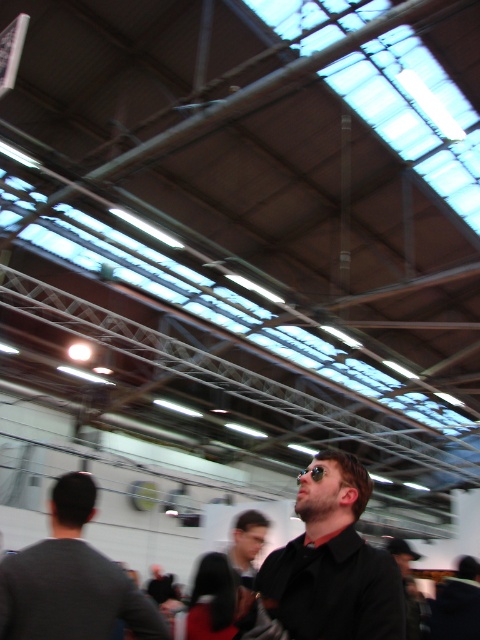
You are a fashion stylist arranging items on a display table. You have a black matte shirt at center and sunglasses at center. According to the scene, which item is more to the left?

The black matte shirt at center is positioned on the left side of sunglasses at center, so the black matte shirt at center is more to the left.

You are standing in the industrial hall and need to pick up the sunglasses at center. The gray fabric shirt at left is blocking your path. Can you walk around it if you have 2 meters of space to maneuver?

The distance between the gray fabric shirt at left and the sunglasses at center is 2.35 meters. Since you need 2 meters to maneuver, you have enough space to walk around the gray fabric shirt at left and reach the sunglasses at center.